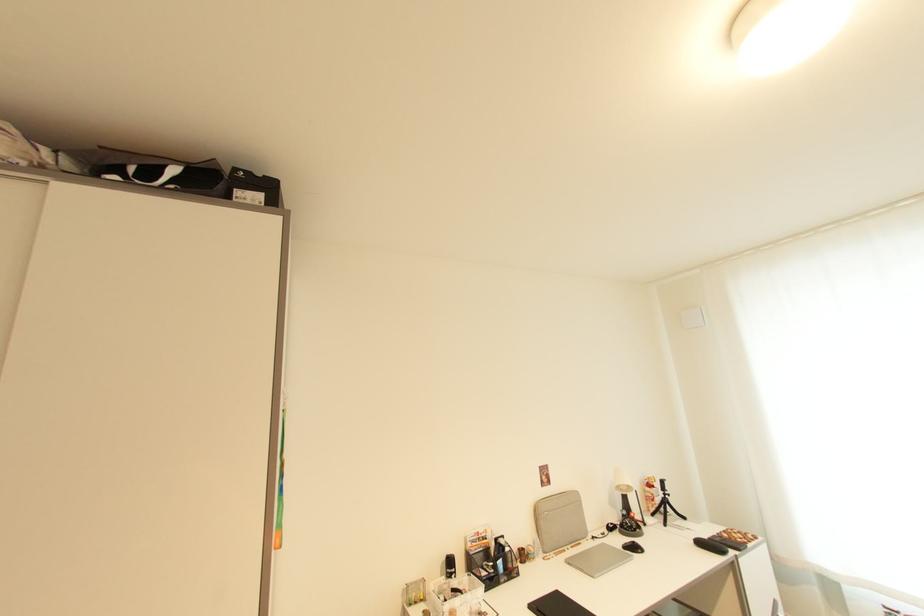
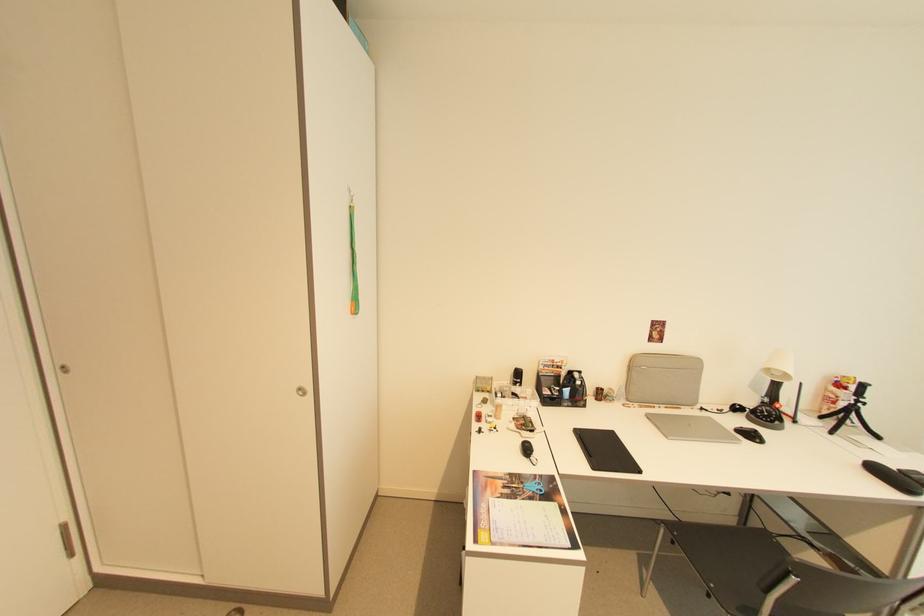
Locate, in the second image, the point that corresponds to point (645, 553) in the first image.

(762, 442)